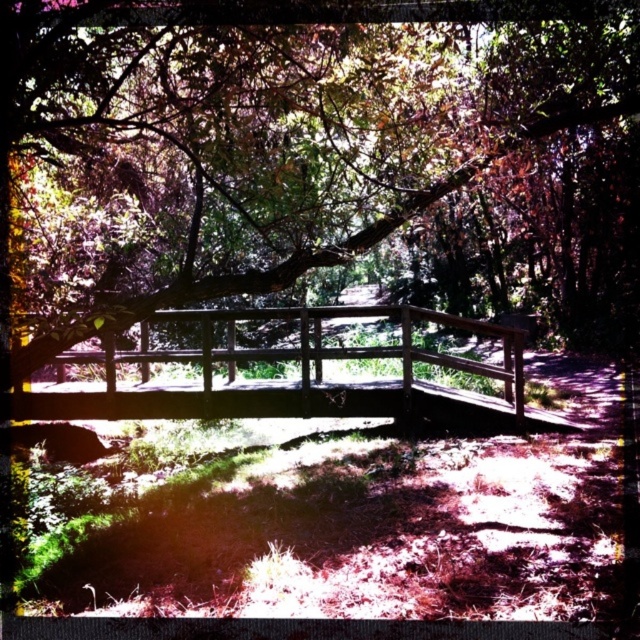
Which is below, green leafy tree at center or wooden bridge at center?

wooden bridge at center is lower down.

Does green leafy tree at center appear over wooden bridge at center?

Correct, green leafy tree at center is located above wooden bridge at center.

I want to click on green leafy tree at center, so click(307, 147).